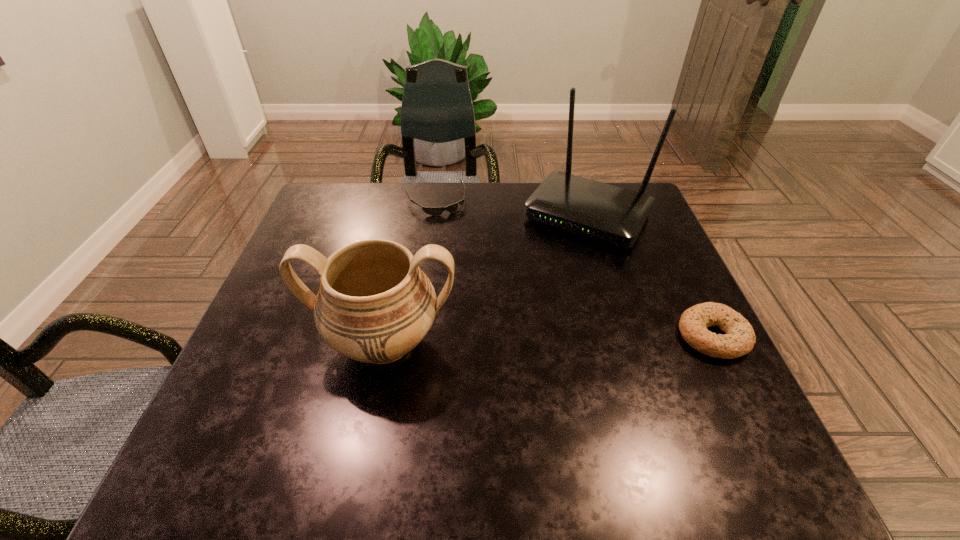
The width and height of the screenshot is (960, 540). What are the coordinates of `vacant spot on the desktop that is between the urn and the bagel and is positioned on the front-facing side of the shortest object` in the screenshot? It's located at (503, 340).

Locate an element on the screen. This screenshot has height=540, width=960. vacant spot on the desktop that is between the second tallest object and the second shortest object and is positioned on the front-facing side of the router is located at coordinates (503, 340).